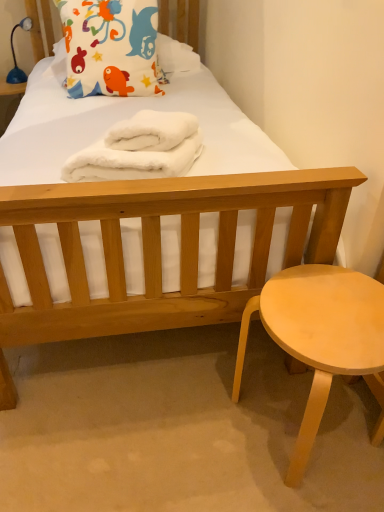
Question: Is fluffy cotton pillow at upper left at the back of light wood stool at lower right?

Choices:
 (A) no
 (B) yes

Answer: (A)

Question: Is light wood stool at lower right positioned beyond the bounds of fluffy cotton pillow at upper left?

Choices:
 (A) no
 (B) yes

Answer: (B)

Question: Can you confirm if light wood stool at lower right is smaller than fluffy cotton pillow at upper left?

Choices:
 (A) yes
 (B) no

Answer: (A)

Question: Considering the relative sizes of light wood stool at lower right and fluffy cotton pillow at upper left in the image provided, is light wood stool at lower right bigger than fluffy cotton pillow at upper left?

Choices:
 (A) no
 (B) yes

Answer: (A)

Question: Does light wood stool at lower right have a lesser width compared to fluffy cotton pillow at upper left?

Choices:
 (A) yes
 (B) no

Answer: (B)

Question: Would you say fluffy cotton pillow at upper left is inside or outside light wood stool at lower right?

Choices:
 (A) inside
 (B) outside

Answer: (B)

Question: In terms of height, does fluffy cotton pillow at upper left look taller or shorter compared to light wood stool at lower right?

Choices:
 (A) short
 (B) tall

Answer: (B)

Question: Looking at their shapes, would you say fluffy cotton pillow at upper left is wider or thinner than light wood stool at lower right?

Choices:
 (A) thin
 (B) wide

Answer: (A)

Question: From the image's perspective, is fluffy cotton pillow at upper left located above or below light wood stool at lower right?

Choices:
 (A) below
 (B) above

Answer: (B)

Question: Is blue plastic lamp at upper left bigger or smaller than white fluffy towels at center?

Choices:
 (A) big
 (B) small

Answer: (B)

Question: Is point (9, 79) positioned closer to the camera than point (175, 134)?

Choices:
 (A) farther
 (B) closer

Answer: (A)

Question: In terms of width, does blue plastic lamp at upper left look wider or thinner when compared to white fluffy towels at center?

Choices:
 (A) wide
 (B) thin

Answer: (B)

Question: Based on their positions, is blue plastic lamp at upper left located to the left or right of white fluffy towels at center?

Choices:
 (A) left
 (B) right

Answer: (A)

Question: Considering the positions of white fluffy towels at center and light wood stool at lower right in the image, is white fluffy towels at center bigger or smaller than light wood stool at lower right?

Choices:
 (A) small
 (B) big

Answer: (A)

Question: Considering the positions of white fluffy towels at center and light wood stool at lower right in the image, is white fluffy towels at center wider or thinner than light wood stool at lower right?

Choices:
 (A) thin
 (B) wide

Answer: (B)